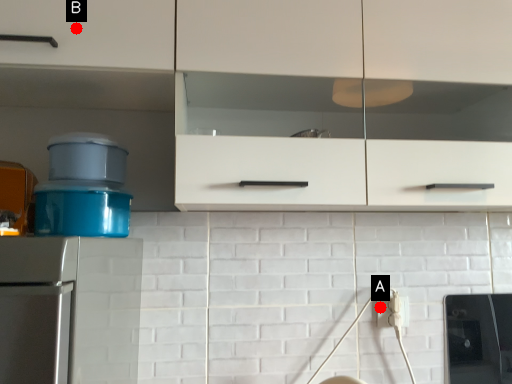
Question: Two points are circled on the image, labeled by A and B beside each circle. Among these points, which one is nearest to the camera?

Choices:
 (A) A is closer
 (B) B is closer

Answer: (B)